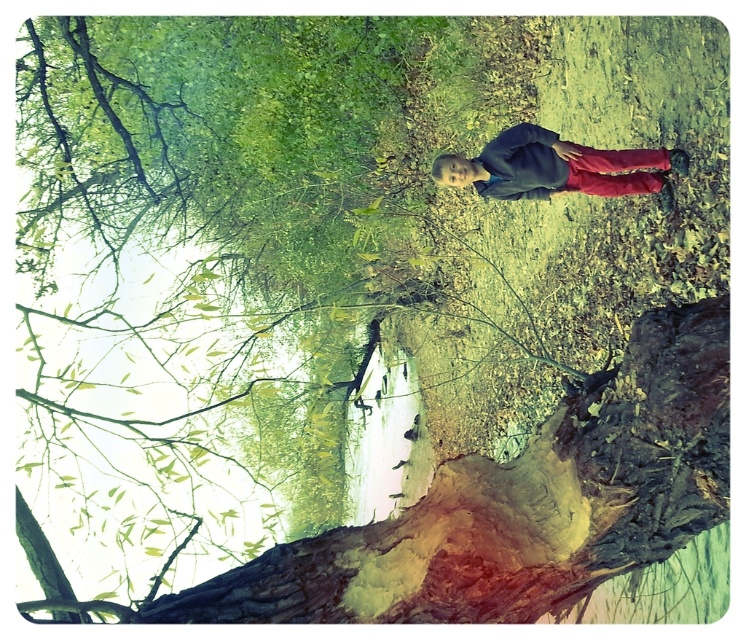
Is smooth bark tree trunk at lower center bigger than matte blue jacket at center?

Yes, smooth bark tree trunk at lower center is bigger than matte blue jacket at center.

The height and width of the screenshot is (640, 746). What do you see at coordinates (521, 506) in the screenshot? I see `smooth bark tree trunk at lower center` at bounding box center [521, 506].

Who is more forward, [700,468] or [545,134]?

Point [700,468] is more forward.

Locate an element on the screen. The height and width of the screenshot is (640, 746). smooth bark tree trunk at lower center is located at coordinates (521, 506).